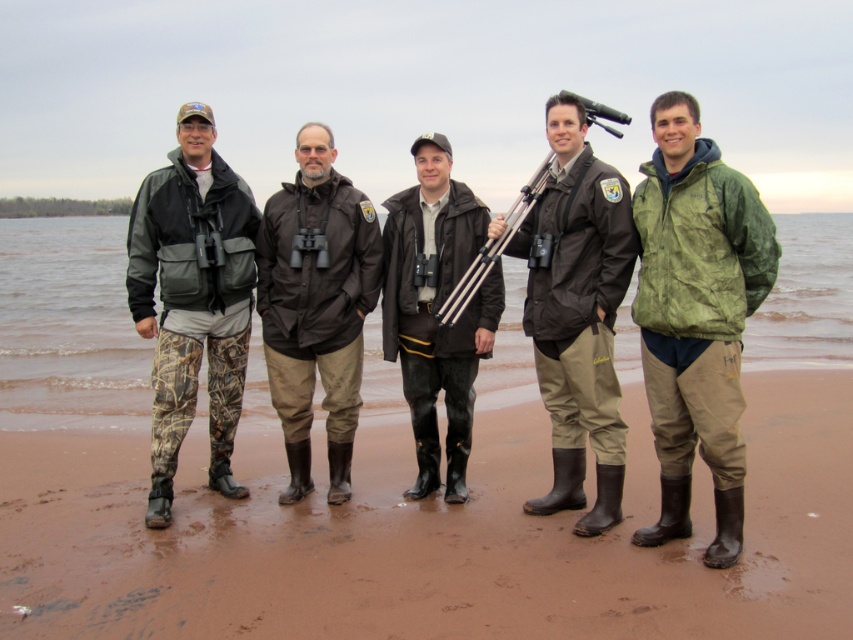
You are a photographer trying to capture a group photo of the five individuals on the beach. You need to ensure that the brown rubber boots at lower center and the brown sand at lower center are both clearly visible in the frame. Given their sizes, which object might require you to adjust your camera angle to ensure it is not too small in the photo?

The brown rubber boots at lower center are narrower than the brown sand at lower center, so you might need to adjust your camera angle to ensure the boots are not too small in the photo.